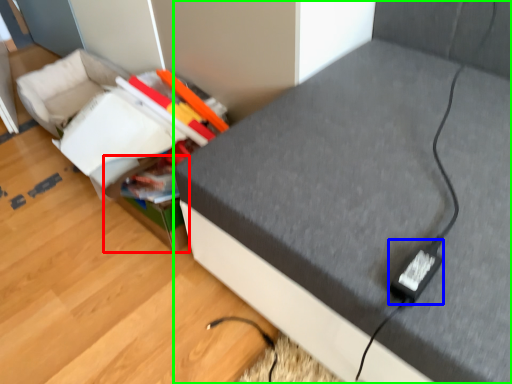
Question: Estimate the real-world distances between objects in this image. Which object is farther from storage box (highlighted by a red box), plug (highlighted by a blue box) or furniture (highlighted by a green box)?

Choices:
 (A) plug
 (B) furniture

Answer: (A)